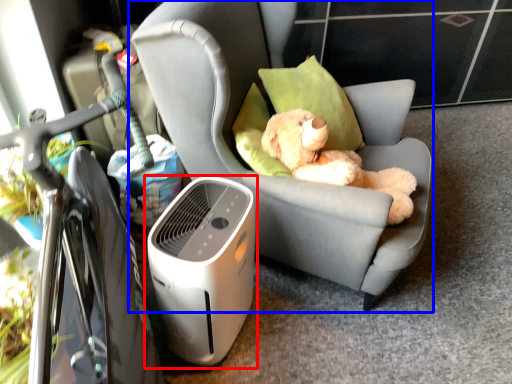
Question: Which point is closer to the camera, home appliance (highlighted by a red box) or chair (highlighted by a blue box)?

Choices:
 (A) home appliance
 (B) chair

Answer: (B)